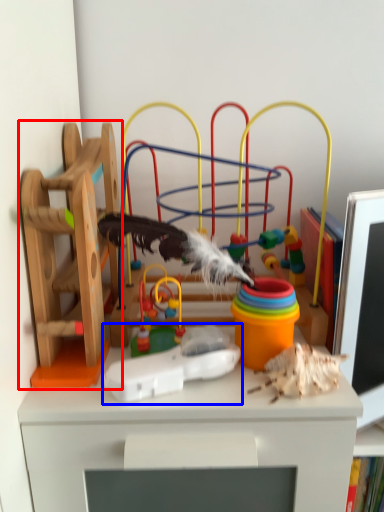
Question: Which point is further to the camera, toy (highlighted by a red box) or toy (highlighted by a blue box)?

Choices:
 (A) toy
 (B) toy

Answer: (B)